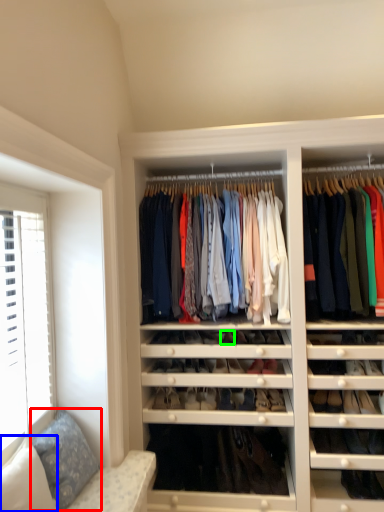
Question: Considering the real-world distances, which object is closest to pillow (highlighted by a red box)? pillow (highlighted by a blue box) or shoe (highlighted by a green box).

Choices:
 (A) pillow
 (B) shoe

Answer: (A)